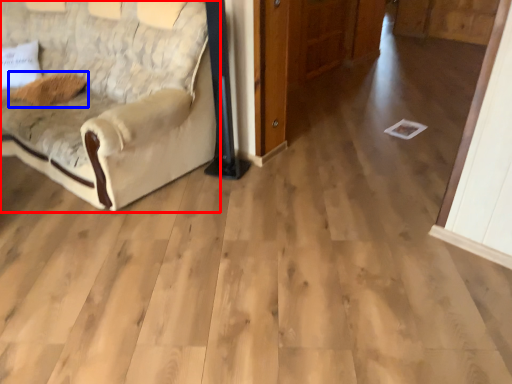
Question: Which point is closer to the camera, studio couch (highlighted by a red box) or pillow (highlighted by a blue box)?

Choices:
 (A) studio couch
 (B) pillow

Answer: (A)